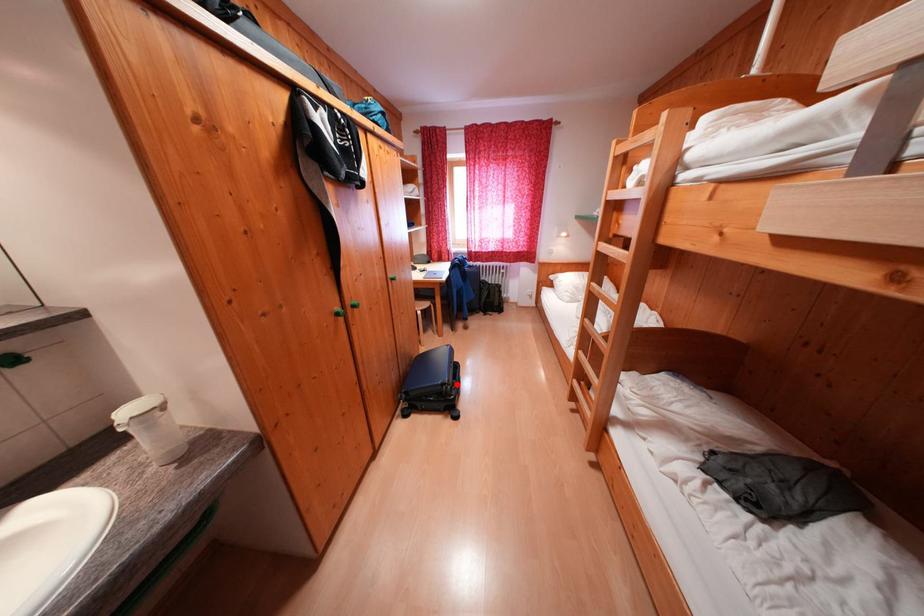
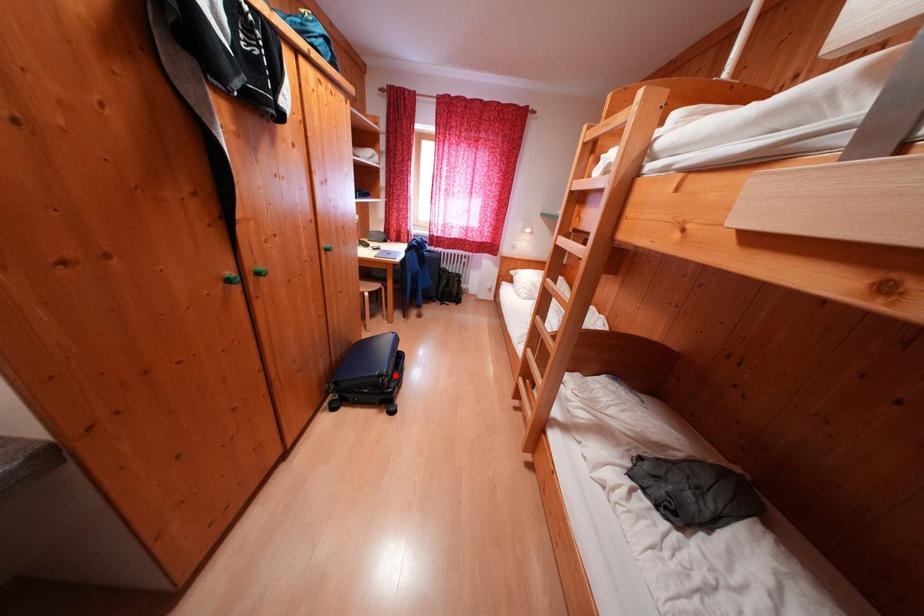
In the scene shown: I am providing you with two images of the same scene from different viewpoints. A red point is marked on the first image and another point is marked on the second image. Is the marked point in image1 the same physical position as the marked point in image2?

Yes